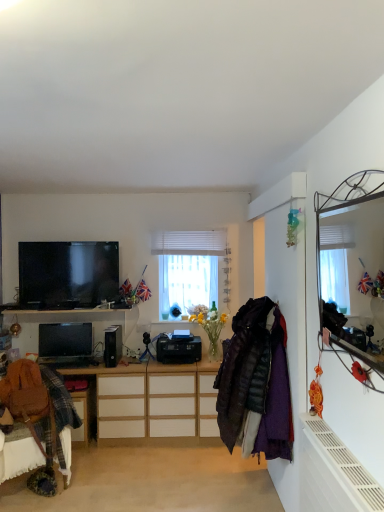
Question: Is white textured blinds at center to the left or to the right of matte black tv at upper left in the image?

Choices:
 (A) left
 (B) right

Answer: (B)

Question: From a real-world perspective, relative to matte black tv at upper left, is white textured blinds at center vertically above or below?

Choices:
 (A) above
 (B) below

Answer: (A)

Question: Which object is the closest to the velvet purple coat at right?

Choices:
 (A) white matte radiator at lower right
 (B) metallic mirror at upper right
 (C) black plastic speaker at center
 (D) brown leather swivel chair at lower left
 (E) wooden cabinet at center

Answer: (A)

Question: Estimate the real-world distances between objects in this image. Which object is closer to the brown leather swivel chair at lower left?

Choices:
 (A) black plastic desktop computer at center
 (B) velvet purple coat at right
 (C) white textured blinds at center
 (D) black plastic speaker at center
 (E) white matte radiator at lower right

Answer: (A)